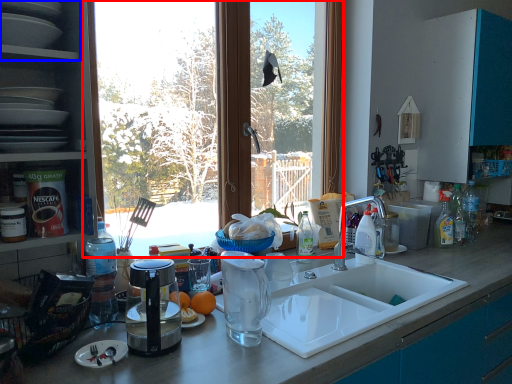
Question: Among these objects, which one is farthest to the camera, window (highlighted by a red box) or shelf (highlighted by a blue box)?

Choices:
 (A) window
 (B) shelf

Answer: (A)